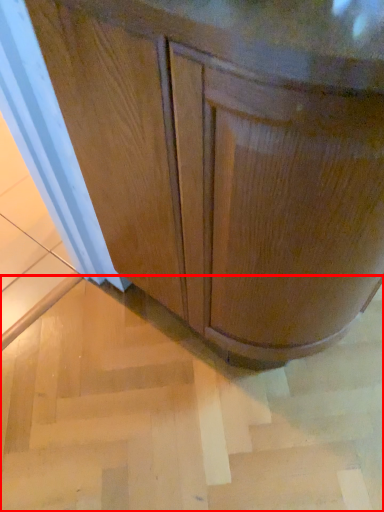
Question: From the image's perspective, considering the relative positions of stair (annotated by the red box) and cabinetry in the image provided, where is stair (annotated by the red box) located with respect to the staircase?

Choices:
 (A) below
 (B) above

Answer: (A)